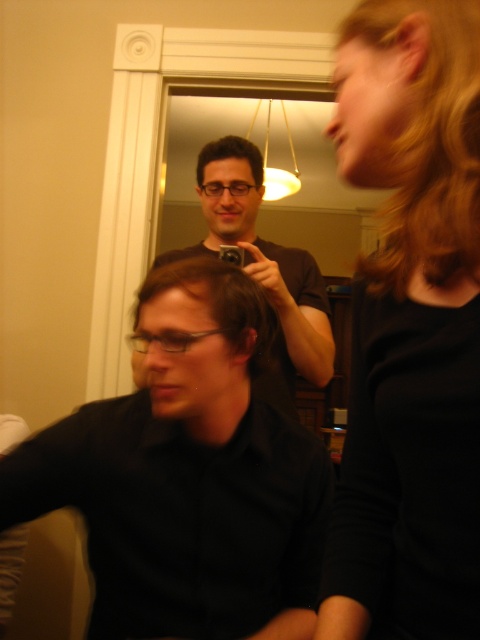
In the scene shown: You are a photographer setting up for a group photo. You see two people in the scene, one with blonde curly hair at upper right and another with dark brown hair at upper center. Which person is positioned more to the right side of the frame?

The blonde curly hair at upper right is positioned more to the right side of the frame compared to the dark brown hair at upper center.

You are a photographer setting up a camera in the living room. You need to position the camera so it can capture both the blonde curly hair at upper right and the dark brown hair at upper center in the same shot. What is the minimum distance the camera should be placed from the closer of the two hairs to ensure both are in frame?

The minimum distance the camera should be placed from the closer of the two hairs is 3.61 feet to ensure both the blonde curly hair at upper right and the dark brown hair at upper center are in frame.